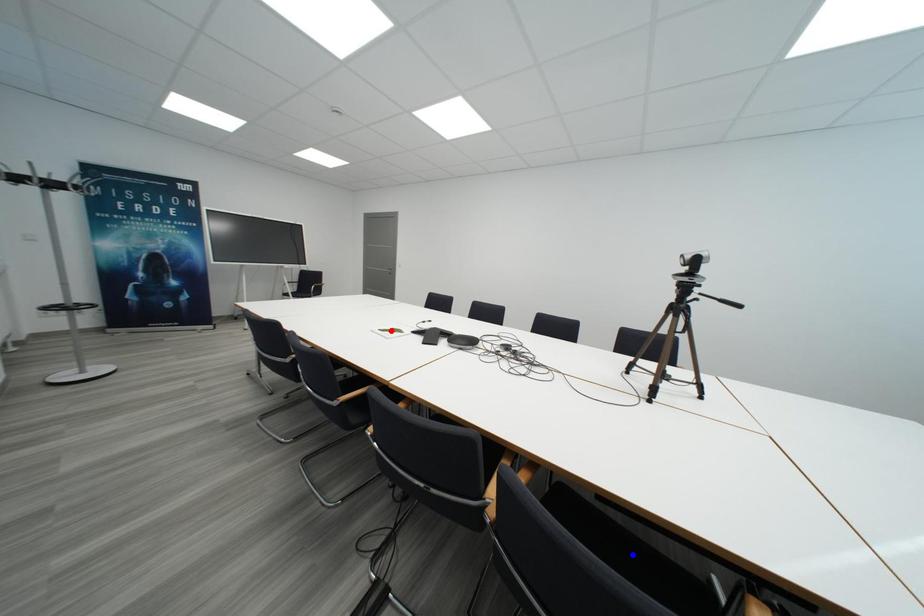
Question: In the image, two points are highlighted. Which point is nearer to the camera? Reply with the corresponding letter.

Choices:
 (A) blue point
 (B) red point

Answer: (A)